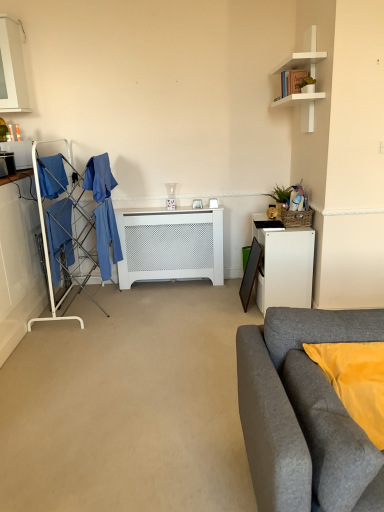
Image resolution: width=384 pixels, height=512 pixels. What are the coordinates of `free location in front of blue fabric drying rack at left` in the screenshot? It's located at (82, 328).